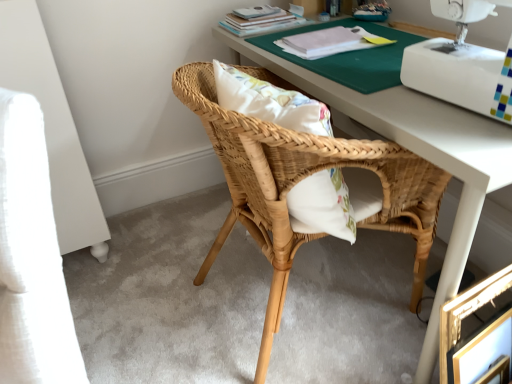
Question: From the image's perspective, is matte paper book at upper center, the 2th book in the front-to-back sequence, beneath white plastic sewing machine at upper right?

Choices:
 (A) yes
 (B) no

Answer: (B)

Question: Is white plastic sewing machine at upper right at the back of matte paper book at upper center, the 2th book in the front-to-back sequence?

Choices:
 (A) yes
 (B) no

Answer: (B)

Question: Is matte paper book at upper center, the 2th book in the front-to-back sequence, closer to the viewer compared to white plastic sewing machine at upper right?

Choices:
 (A) yes
 (B) no

Answer: (B)

Question: Is matte paper book at upper center, placed as the 1th book when sorted from back to front, further to camera compared to white plastic sewing machine at upper right?

Choices:
 (A) no
 (B) yes

Answer: (B)

Question: From a real-world perspective, is matte paper book at upper center, placed as the 1th book when sorted from back to front, on top of white plastic sewing machine at upper right?

Choices:
 (A) yes
 (B) no

Answer: (B)

Question: Does matte paper book at upper center, the 2th book in the front-to-back sequence, have a greater height compared to gold metallic picture frame at lower right?

Choices:
 (A) yes
 (B) no

Answer: (B)

Question: From a real-world perspective, is matte paper book at upper center, the 2th book in the front-to-back sequence, under gold metallic picture frame at lower right?

Choices:
 (A) no
 (B) yes

Answer: (A)

Question: Would you consider matte paper book at upper center, the 2th book in the front-to-back sequence, to be distant from gold metallic picture frame at lower right?

Choices:
 (A) yes
 (B) no

Answer: (A)

Question: Is matte paper book at upper center, placed as the 1th book when sorted from back to front, looking in the opposite direction of gold metallic picture frame at lower right?

Choices:
 (A) yes
 (B) no

Answer: (B)

Question: Can you confirm if matte paper book at upper center, placed as the 1th book when sorted from back to front, is smaller than gold metallic picture frame at lower right?

Choices:
 (A) yes
 (B) no

Answer: (A)

Question: Could gold metallic picture frame at lower right be considered to be inside matte paper book at upper center, the 2th book in the front-to-back sequence?

Choices:
 (A) yes
 (B) no

Answer: (B)

Question: Is white plastic sewing machine at upper right with natural wood chair at center?

Choices:
 (A) yes
 (B) no

Answer: (B)